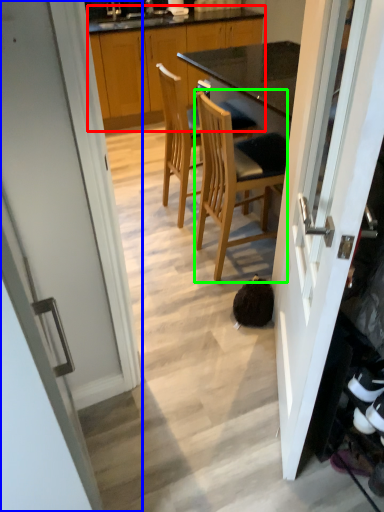
Question: Which object is positioned closest to cabinetry (highlighted by a red box)? Select from door (highlighted by a blue box) and chair (highlighted by a green box).

Choices:
 (A) door
 (B) chair

Answer: (B)